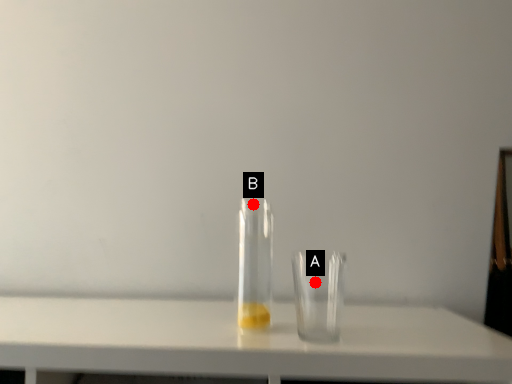
Question: Two points are circled on the image, labeled by A and B beside each circle. Which of the following is the farthest from the observer?

Choices:
 (A) A is further
 (B) B is further

Answer: (A)